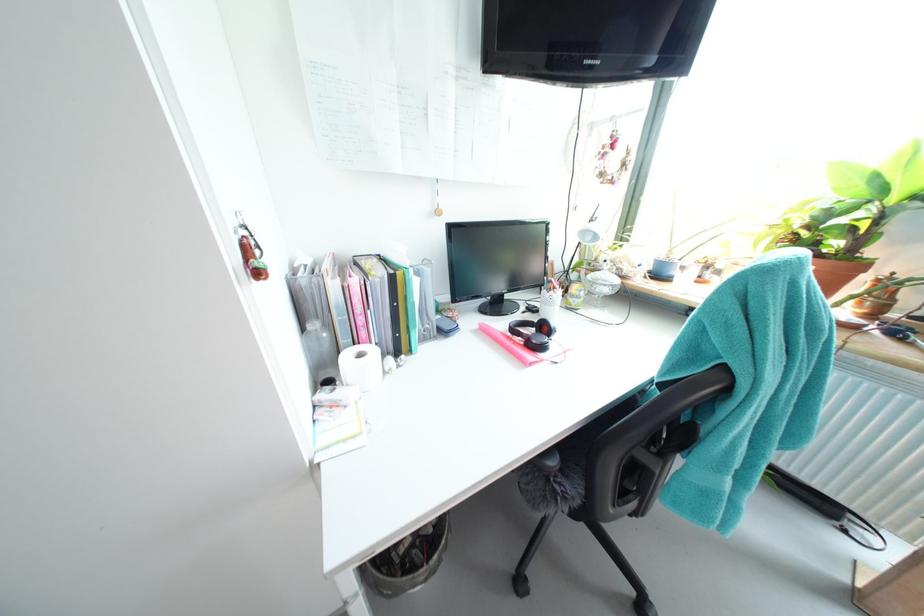
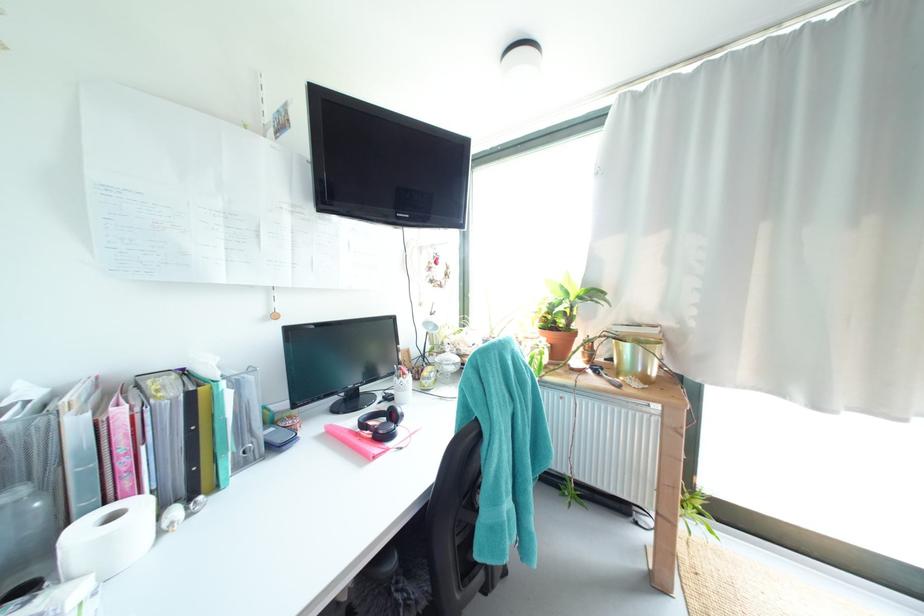
Locate, in the second image, the point that corresponds to [371,336] in the first image.

(135, 485)